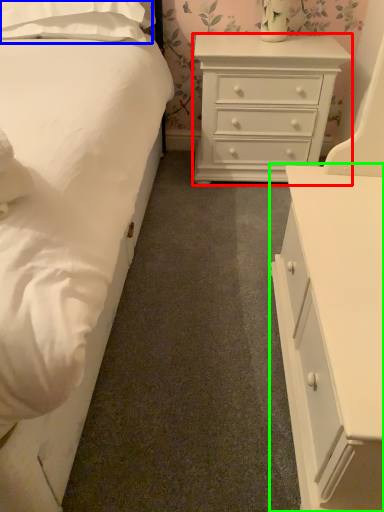
Question: Which object is positioned closest to chest of drawers (highlighted by a red box)? Select from pillow (highlighted by a blue box) and chest of drawers (highlighted by a green box).

Choices:
 (A) pillow
 (B) chest of drawers

Answer: (A)